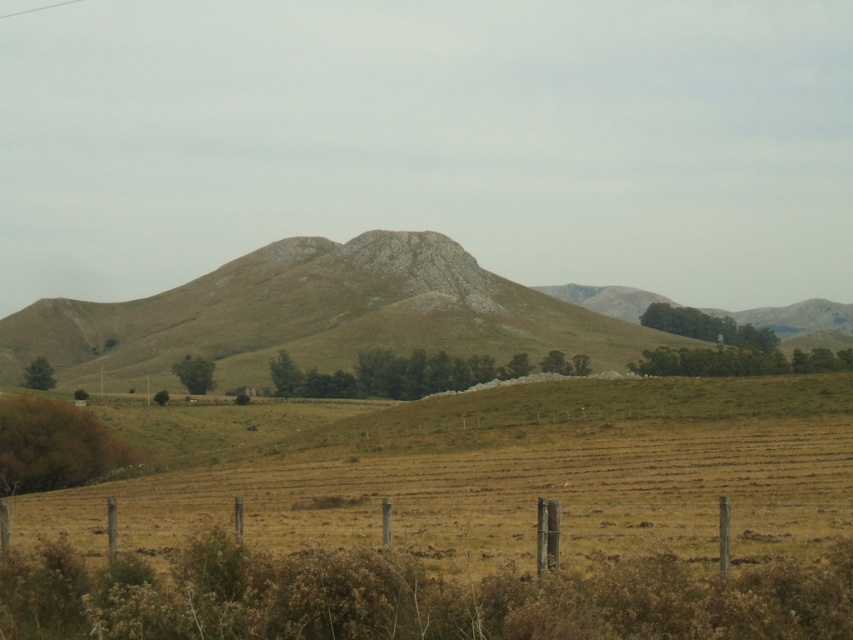
Question: Does dry grassland at center have a smaller size compared to rugged brown mountain at center?

Choices:
 (A) no
 (B) yes

Answer: (B)

Question: Does dry grassland at center appear on the right side of rugged brown mountain at center?

Choices:
 (A) no
 (B) yes

Answer: (A)

Question: Among these objects, which one is nearest to the camera?

Choices:
 (A) dry grassland at center
 (B) rugged brown mountain at center

Answer: (A)

Question: From the image, what is the correct spatial relationship of dry grassland at center in relation to rugged brown mountain at center?

Choices:
 (A) left
 (B) right

Answer: (A)

Question: Estimate the real-world distances between objects in this image. Which object is closer to the brown wooden fence at lower center?

Choices:
 (A) dry grassland at center
 (B) rugged brown mountain at center

Answer: (A)

Question: Based on their relative distances, which object is farther from the brown wooden fence at lower center?

Choices:
 (A) rugged brown mountain at center
 (B) dry grassland at center

Answer: (A)